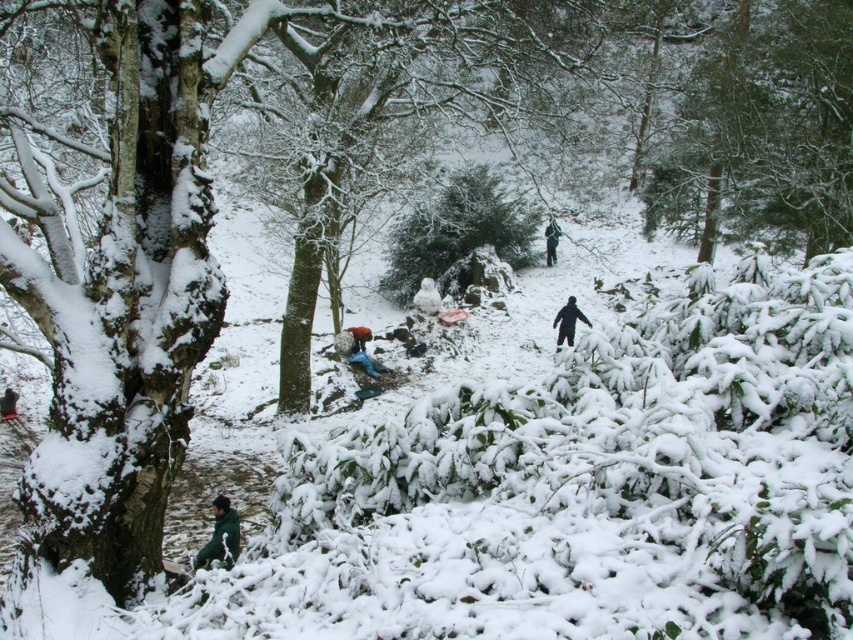
Question: Which point is closer to the camera?

Choices:
 (A) (9, 403)
 (B) (556, 237)
 (C) (401, 246)
 (D) (213, 518)

Answer: (D)

Question: Does black matte snowsuit at center come in front of dark green jacket at lower left?

Choices:
 (A) no
 (B) yes

Answer: (A)

Question: Observing the image, what is the correct spatial positioning of green textured bush at center in reference to dark green jacket at lower left?

Choices:
 (A) left
 (B) right

Answer: (B)

Question: Estimate the real-world distances between objects in this image. Which object is farther from the green textured bush at center?

Choices:
 (A) black matte snowsuit at center
 (B) dark green jacket at lower left
 (C) green matte jacket at lower left

Answer: (C)

Question: Can you confirm if black matte person at center-right is positioned to the right of dark green jacket at lower left?

Choices:
 (A) no
 (B) yes

Answer: (B)

Question: Which point appears farthest from the camera in this image?

Choices:
 (A) (424, 224)
 (B) (550, 259)

Answer: (B)